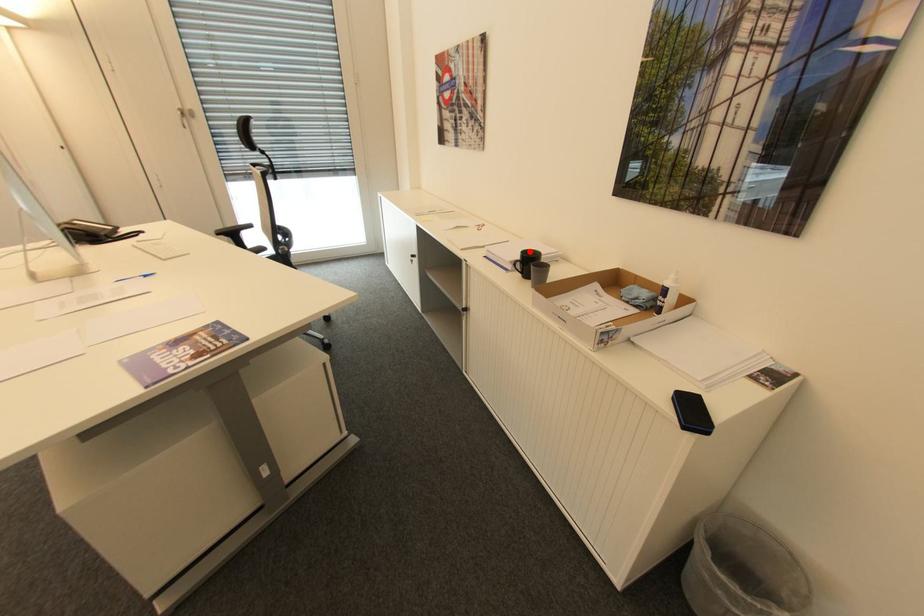
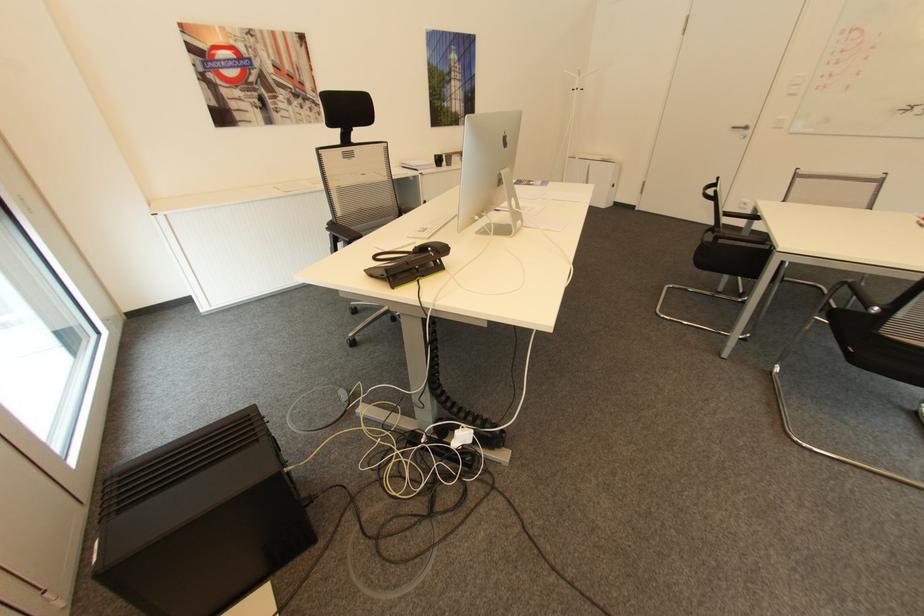
The point at the highlighted location is marked in the first image. Where is the corresponding point in the second image?

(441, 155)